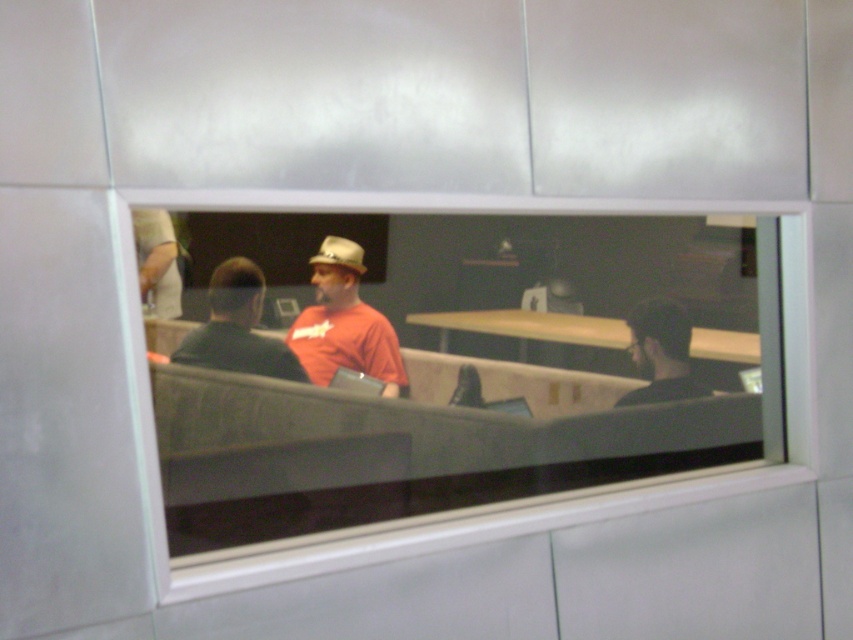
You are standing outside the window and want to greet the person wearing the black matte shirt at left. Based on their position, which direction should you move to get closer to them?

The black matte shirt at left is positioned at point 0.514 on the x axis and 0.279 on the y axis. To get closer to them, you should move towards the left side of the window since their coordinates indicate they are located towards the left.

From the picture: You are standing outside the window and want to see if you can fit a rectangular poster that is 1.2 meters wide between the clear glass window at center and the dark gray shirt at right. Can you determine if the space between them is wide enough?

The clear glass window at center is wider than the dark gray shirt at right, but the exact distance between them isn not specified. Without knowing the actual spacing, it is impossible to confirm if the poster will fit.